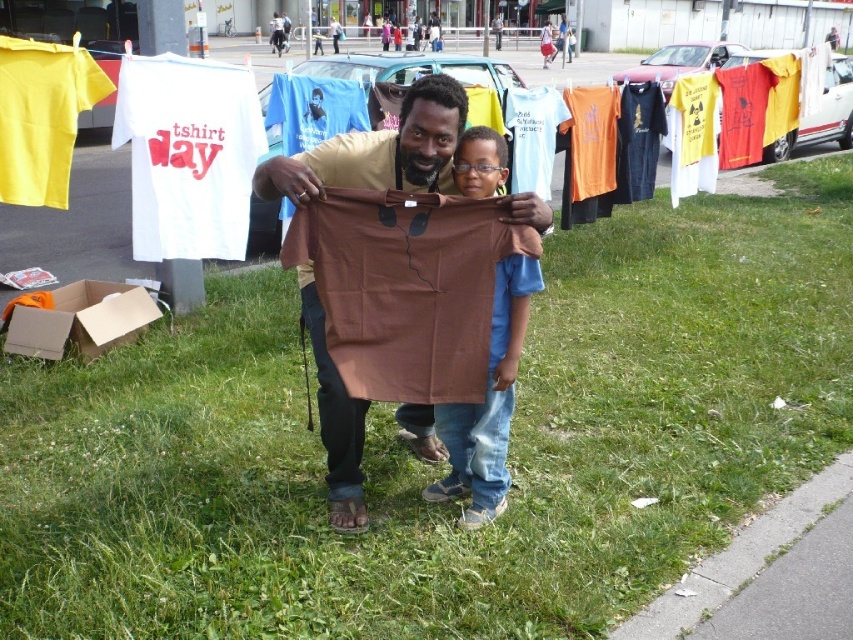
Question: Estimate the real-world distances between objects in this image. Which object is closer to the brown cardboard at lower left?

Choices:
 (A) brown fabric shirt at center
 (B) brown matte t-shirt at center

Answer: (B)

Question: Can you confirm if brown fabric shirt at center is smaller than brown cardboard at lower left?

Choices:
 (A) no
 (B) yes

Answer: (A)

Question: Can you confirm if brown fabric shirt at center is wider than brown cardboard at lower left?

Choices:
 (A) no
 (B) yes

Answer: (A)

Question: Estimate the real-world distances between objects in this image. Which object is farther from the brown matte t-shirt at center?

Choices:
 (A) brown fabric shirt at center
 (B) brown cardboard at lower left

Answer: (B)

Question: Can you confirm if brown matte t-shirt at center is positioned above brown cardboard at lower left?

Choices:
 (A) no
 (B) yes

Answer: (B)

Question: Among these points, which one is nearest to the camera?

Choices:
 (A) (474, 496)
 (B) (366, 132)

Answer: (B)